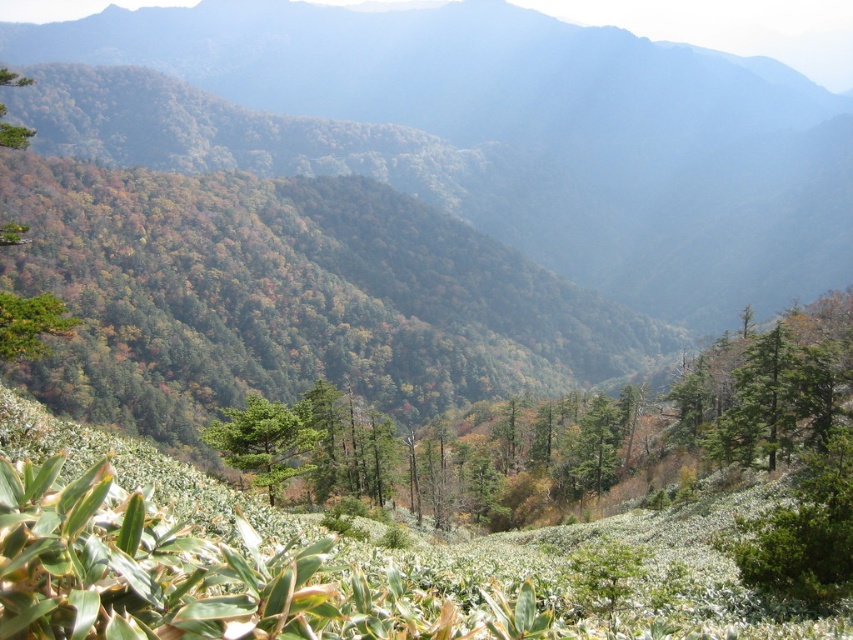
Where is `green matte tree at center`? This screenshot has height=640, width=853. green matte tree at center is located at coordinates (264, 440).

Does green matte tree at center have a greater width compared to green matte tree at center-right?

Indeed, green matte tree at center has a greater width compared to green matte tree at center-right.

Which is in front, point (224, 458) or point (740, 413)?

Positioned in front is point (224, 458).

Locate an element on the screen. This screenshot has height=640, width=853. green matte tree at center is located at coordinates point(264,440).